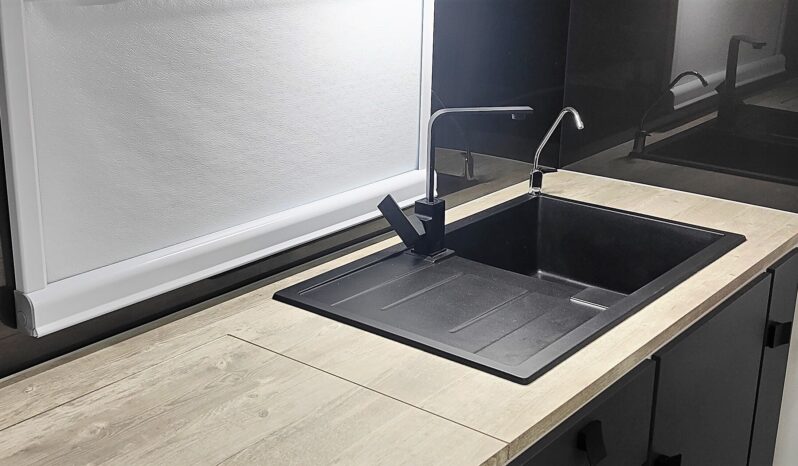
Identify the location of white wall behind sink. (337, 50).